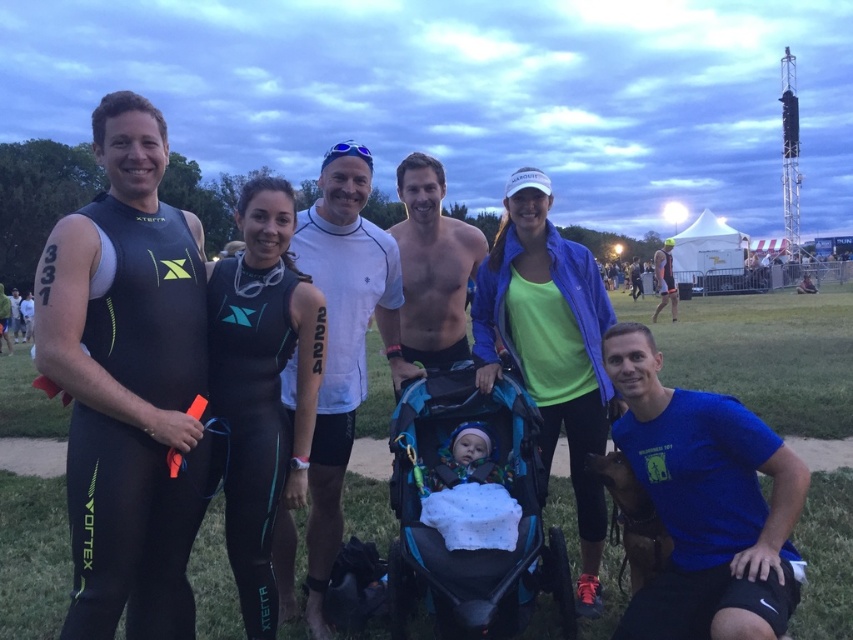
Question: Is neon green fabric at center to the right of shiny black skin at center from the viewer's perspective?

Choices:
 (A) yes
 (B) no

Answer: (A)

Question: Which point is closer to the camera taking this photo?

Choices:
 (A) (294, 230)
 (B) (186, 442)

Answer: (B)

Question: Estimate the real-world distances between objects in this image. Which object is closer to the neon green fabric at center?

Choices:
 (A) teal fabric stroller at center
 (B) white matte shirt at center
 (C) teal matte wetsuit at center

Answer: (A)

Question: Where is neon green fabric at center located in relation to shiny black skin at center in the image?

Choices:
 (A) below
 (B) above

Answer: (A)

Question: Among these objects, which one is nearest to the camera?

Choices:
 (A) teal fabric stroller at center
 (B) matte black wetsuit at left

Answer: (B)

Question: From the image, what is the correct spatial relationship of matte black wetsuit at left in relation to shiny black skin at center?

Choices:
 (A) above
 (B) below

Answer: (B)